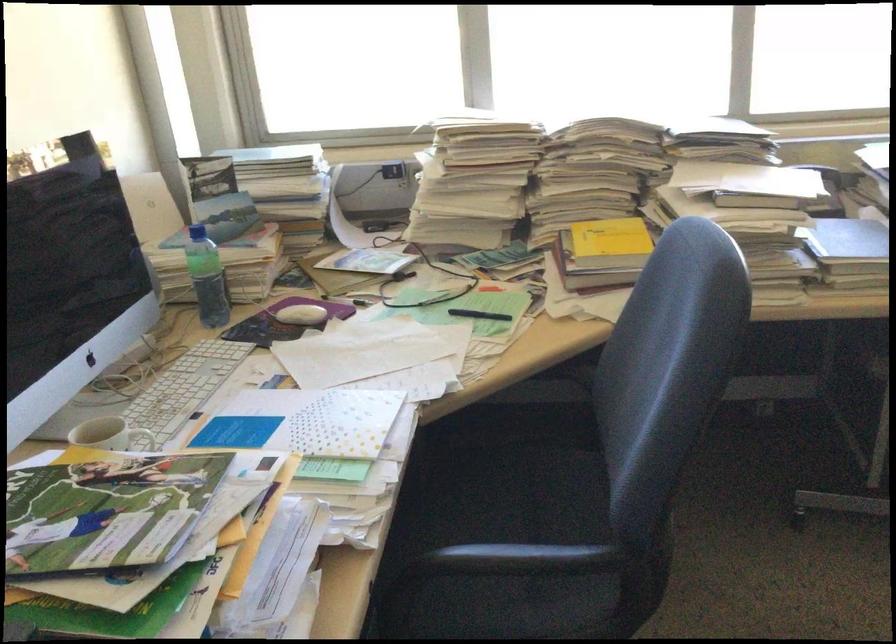
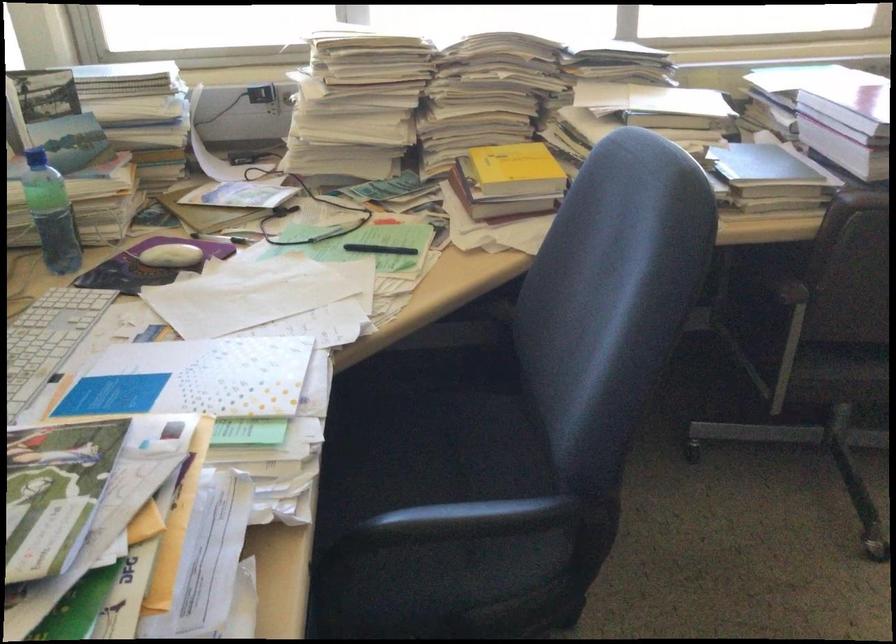
What movement of the cameraman would produce the second image?

The cameraman moved toward left, forward.